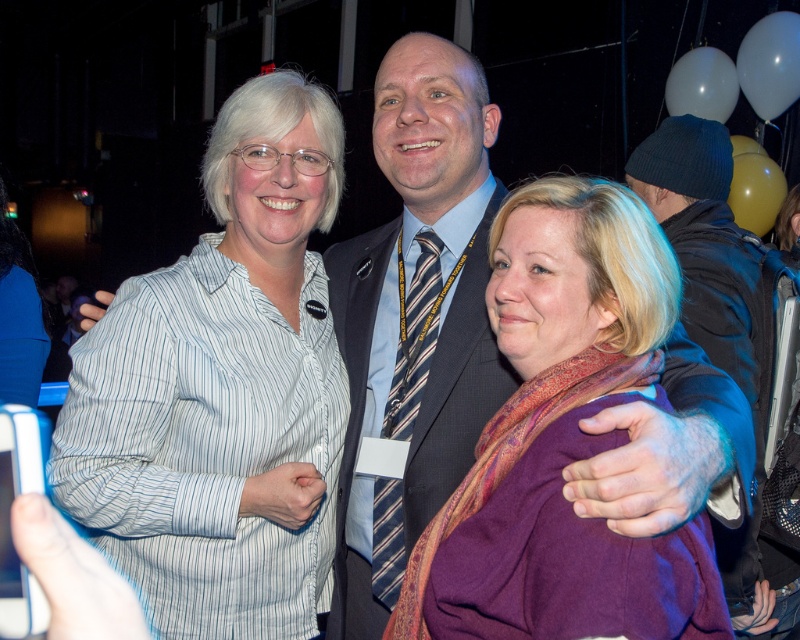
Can you confirm if white striped shirt at left is smaller than purple wool scarf at center?

Incorrect, white striped shirt at left is not smaller in size than purple wool scarf at center.

The width and height of the screenshot is (800, 640). Describe the element at coordinates (224, 392) in the screenshot. I see `white striped shirt at left` at that location.

In order to click on white striped shirt at left in this screenshot , I will do `click(224, 392)`.

In order to click on white striped shirt at left in this screenshot , I will do `click(224, 392)`.

Is point (90, 404) positioned after point (772, 593)?

No.

This screenshot has width=800, height=640. I want to click on white striped shirt at left, so click(224, 392).

How far apart are dark gray suit at center and dark blue knit cap at right?

37.56 inches

Is dark gray suit at center further to the viewer compared to dark blue knit cap at right?

No.

The image size is (800, 640). Identify the location of dark gray suit at center. (414, 317).